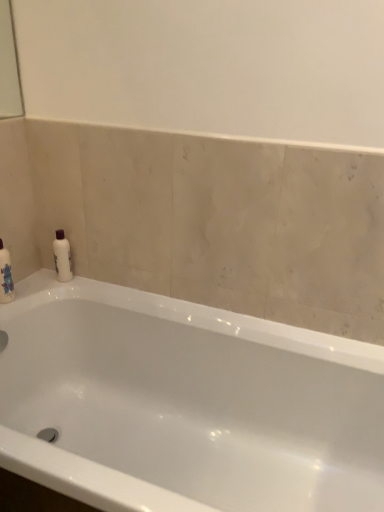
What is the approximate height of white glossy bottle at upper left?

white glossy bottle at upper left is 7.76 inches tall.

I want to click on white glossy bottle at upper left, so click(x=62, y=257).

This screenshot has width=384, height=512. What do you see at coordinates (62, 257) in the screenshot?
I see `white glossy bottle at upper left` at bounding box center [62, 257].

The image size is (384, 512). What are the coordinates of `white glossy bathtub at center` in the screenshot? It's located at (185, 404).

In order to face white glossy bathtub at center, should I rotate leftwards or rightwards?

To face it directly, rotate left by 3.994 degrees.

What do you see at coordinates (185, 404) in the screenshot? I see `white glossy bathtub at center` at bounding box center [185, 404].

Image resolution: width=384 pixels, height=512 pixels. What are the coordinates of `white glossy bottle at upper left` in the screenshot? It's located at (62, 257).

Which object is positioned more to the right, white glossy bathtub at center or white glossy bottle at upper left?

white glossy bathtub at center.

Which object is closer to the camera taking this photo, white glossy bathtub at center or white glossy bottle at upper left?

white glossy bathtub at center is in front.

Is point (333, 351) closer or farther from the camera than point (63, 250)?

Point (333, 351) is positioned closer to the camera compared to point (63, 250).

From the image's perspective, is white glossy bathtub at center located above or below white glossy bottle at upper left?

white glossy bathtub at center is situated lower than white glossy bottle at upper left in the image.

From a real-world perspective, is white glossy bathtub at center over white glossy bottle at upper left?

Actually, white glossy bathtub at center is physically below white glossy bottle at upper left in the real world.

Which of these two, white glossy bathtub at center or white glossy bottle at upper left, is wider?

Wider between the two is white glossy bathtub at center.

Does white glossy bathtub at center have a lesser height compared to white glossy bottle at upper left?

Incorrect, the height of white glossy bathtub at center does not fall short of that of white glossy bottle at upper left.

Does white glossy bathtub at center have a smaller size compared to white glossy bottle at upper left?

No.

Which is correct: white glossy bathtub at center is inside white glossy bottle at upper left, or outside of it?

The correct answer is: outside.

Can you see white glossy bathtub at center touching white glossy bottle at upper left?

white glossy bathtub at center is not next to white glossy bottle at upper left, and they're not touching.

Is white glossy bottle at upper left at the back of white glossy bathtub at center?

white glossy bathtub at center is not turned away from white glossy bottle at upper left.

How much distance is there between white glossy bathtub at center and white glossy bottle at upper left?

white glossy bathtub at center is 21.44 inches from white glossy bottle at upper left.

Identify the location of mouthwash above the white glossy bathtub at center (from a real-world perspective). pyautogui.click(x=62, y=257).

Considering the positions of objects white glossy bottle at upper left and white glossy bathtub at center in the image provided, who is more to the right, white glossy bottle at upper left or white glossy bathtub at center?

white glossy bathtub at center.

Is the position of white glossy bottle at upper left less distant than that of white glossy bathtub at center?

No, the depth of white glossy bottle at upper left is greater than that of white glossy bathtub at center.

Which is behind, point (68, 247) or point (239, 483)?

Point (68, 247)

From the image's perspective, which one is positioned higher, white glossy bottle at upper left or white glossy bathtub at center?

white glossy bottle at upper left.

From a real-world perspective, is white glossy bottle at upper left positioned over white glossy bathtub at center based on gravity?

Yes.

Does white glossy bottle at upper left have a lesser width compared to white glossy bathtub at center?

Yes, white glossy bottle at upper left is thinner than white glossy bathtub at center.

Considering the sizes of white glossy bottle at upper left and white glossy bathtub at center in the image, is white glossy bottle at upper left taller or shorter than white glossy bathtub at center?

white glossy bottle at upper left is shorter than white glossy bathtub at center.

Considering the sizes of objects white glossy bottle at upper left and white glossy bathtub at center in the image provided, who is smaller, white glossy bottle at upper left or white glossy bathtub at center?

Smaller between the two is white glossy bottle at upper left.

Would you say white glossy bottle at upper left is outside white glossy bathtub at center?

Yes, white glossy bottle at upper left is located beyond the bounds of white glossy bathtub at center.

Is white glossy bottle at upper left positioned far away from white glossy bathtub at center?

They are positioned close to each other.

Is white glossy bathtub at center at the back of white glossy bottle at upper left?

That's not correct — white glossy bottle at upper left is not looking away from white glossy bathtub at center.

How many degrees apart are the facing directions of white glossy bottle at upper left and white glossy bathtub at center?

The facing directions of white glossy bottle at upper left and white glossy bathtub at center are 4.19 degrees apart.

How far apart are white glossy bottle at upper left and white glossy bathtub at center?

white glossy bottle at upper left is 21.44 inches from white glossy bathtub at center.

Where is `mouthwash above the white glossy bathtub at center (from the image's perspective)`? The width and height of the screenshot is (384, 512). mouthwash above the white glossy bathtub at center (from the image's perspective) is located at coordinates click(62, 257).

The width and height of the screenshot is (384, 512). Find the location of `mouthwash lying on the left of white glossy bathtub at center`. mouthwash lying on the left of white glossy bathtub at center is located at coordinates (62, 257).

Locate an element on the screen. This screenshot has width=384, height=512. bathtub lying below the white glossy bottle at upper left (from the image's perspective) is located at coordinates (185, 404).